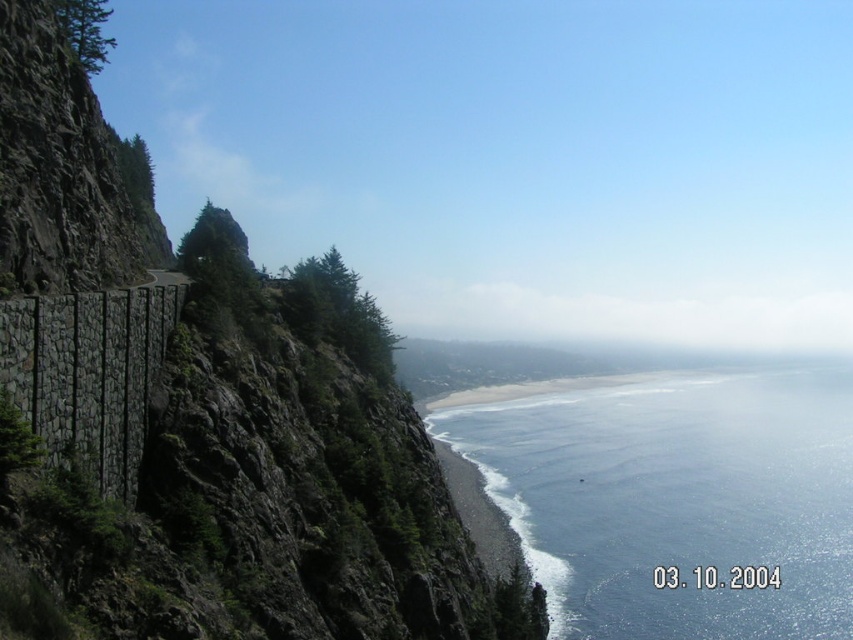
Which of these two, rocky cliff at left or blue liquid water at lower center, stands taller?

Standing taller between the two is rocky cliff at left.

Who is more distant from viewer, (373,566) or (769,490)?

Point (769,490)

Locate an element on the screen. rocky cliff at left is located at coordinates (239, 465).